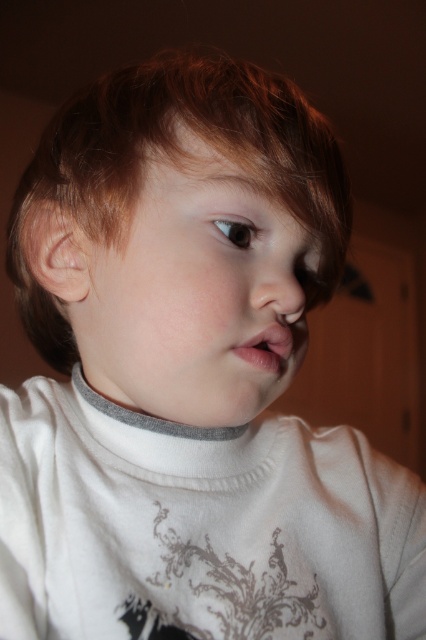
Question: Which point is farther to the camera?

Choices:
 (A) click(287, 280)
 (B) click(241, 349)

Answer: (A)

Question: Does smooth skin face at center have a lesser width compared to pink glossy lips at center?

Choices:
 (A) no
 (B) yes

Answer: (A)

Question: Can you confirm if smooth skin face at center is bigger than pink glossy lips at center?

Choices:
 (A) yes
 (B) no

Answer: (A)

Question: Which of the following is the closest to the observer?

Choices:
 (A) smooth skin face at center
 (B) pink glossy lips at center

Answer: (A)

Question: Can you confirm if smooth skin face at center is positioned to the left of pink glossy lips at center?

Choices:
 (A) yes
 (B) no

Answer: (A)